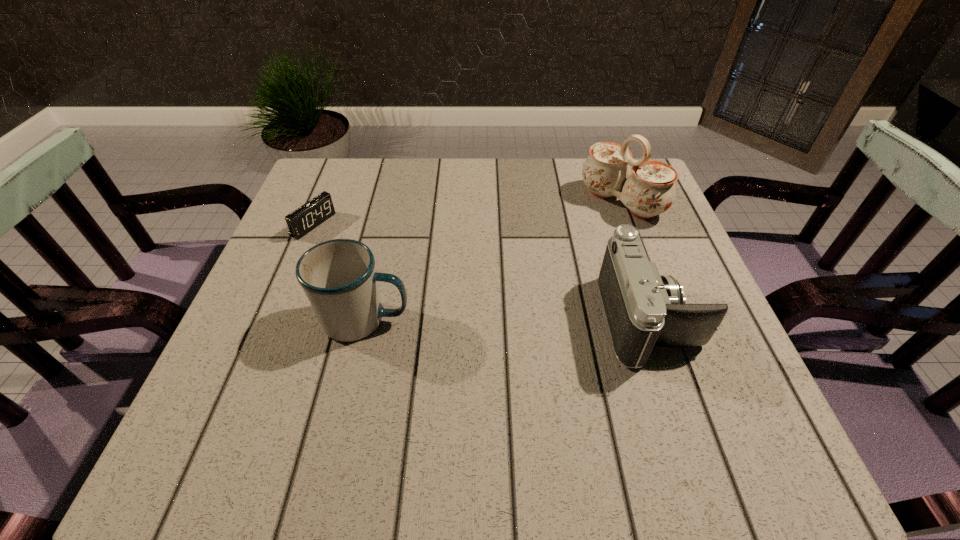
Where is `object present at the far right corner`? The height and width of the screenshot is (540, 960). object present at the far right corner is located at coordinates (650, 190).

This screenshot has width=960, height=540. I want to click on object that is at the near right corner, so click(x=643, y=309).

In the image, there is a desktop. Identify the location of vacant space at the far edge. (422, 185).

This screenshot has width=960, height=540. What are the coordinates of `vacant space at the near edge of the desktop` in the screenshot? It's located at (517, 407).

Find the location of `free region at the far left corner of the desktop`. free region at the far left corner of the desktop is located at coordinates (369, 171).

In the image, there is a desktop. Identify the location of vacant space at the near right corner. coord(671,370).

The image size is (960, 540). I want to click on vacant space that is in between the camera and the shortest object, so click(481, 272).

Identify the location of free space that is in between the alarm clock and the camera. The height and width of the screenshot is (540, 960). (481, 272).

In order to click on free space between the camera and the leftmost object in this screenshot , I will do `click(481, 272)`.

Where is `vacant area that lies between the chinaware and the shortest object`? The height and width of the screenshot is (540, 960). vacant area that lies between the chinaware and the shortest object is located at coordinates (468, 213).